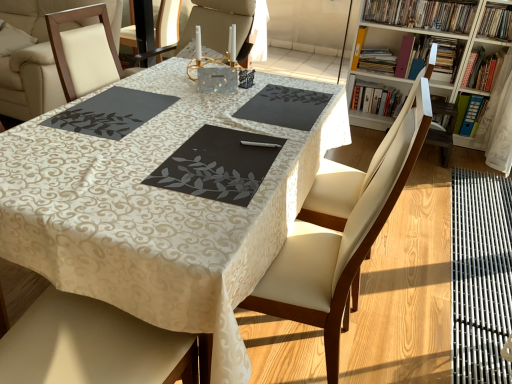
At what (x,y) coordinates should I click in order to perform the action: click on free location in front of black matte place mat at center, the second place mat from the left. Please return your answer as a coordinate pair (x, y). The width and height of the screenshot is (512, 384). Looking at the image, I should click on (168, 227).